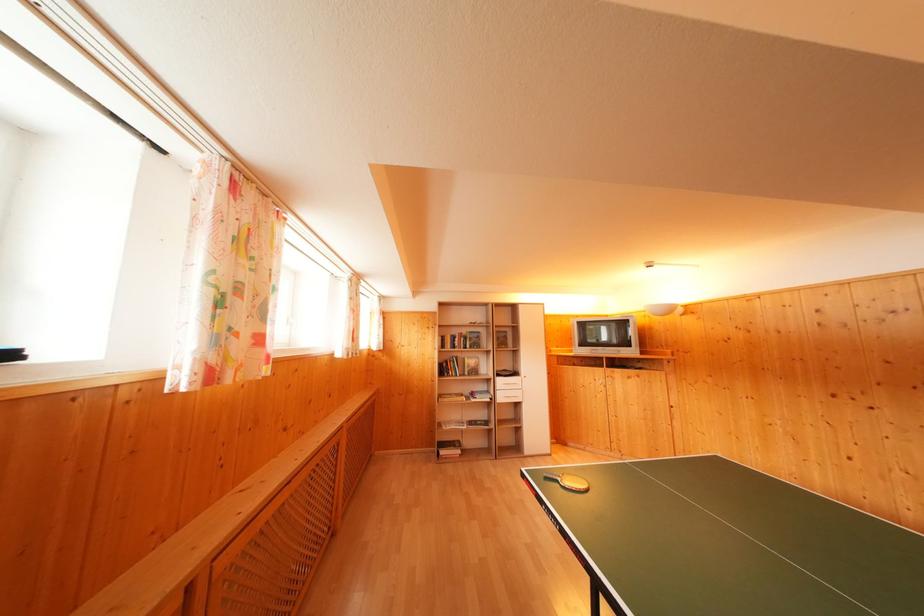
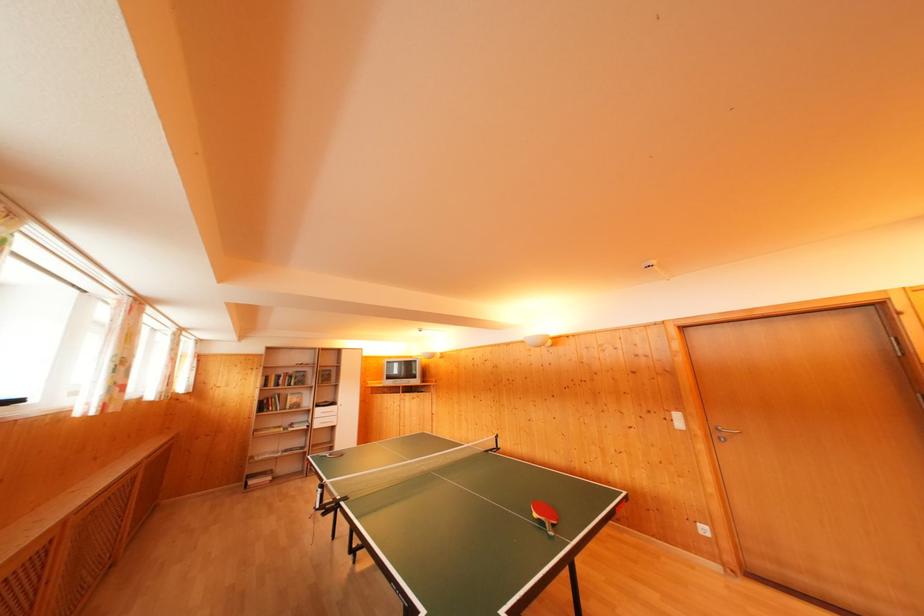
Where in the second image is the point corresponding to point 447,375 from the first image?

(268, 411)